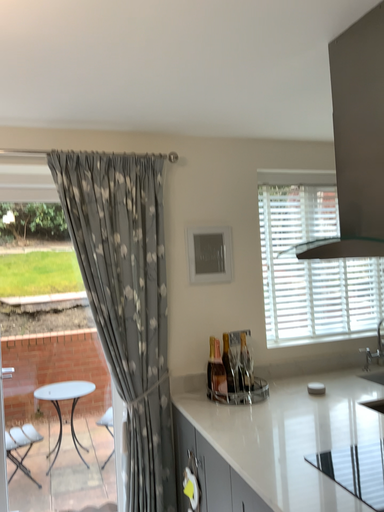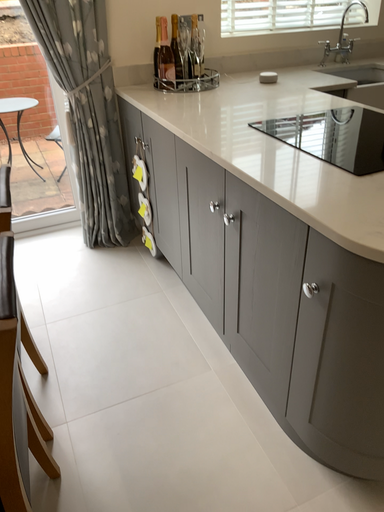
Question: How did the camera likely rotate when shooting the video?

Choices:
 (A) rotated upward
 (B) rotated downward

Answer: (B)